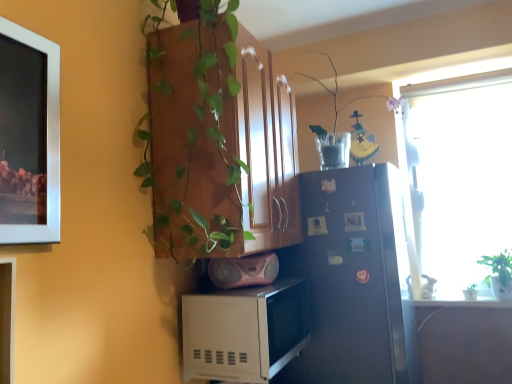
Question: Is satin black refrigerator at right further to the viewer compared to white matte microwave at lower center?

Choices:
 (A) no
 (B) yes

Answer: (B)

Question: From a real-world perspective, is satin black refrigerator at right under white matte microwave at lower center?

Choices:
 (A) yes
 (B) no

Answer: (B)

Question: Does satin black refrigerator at right contain white matte microwave at lower center?

Choices:
 (A) no
 (B) yes

Answer: (A)

Question: Does satin black refrigerator at right have a lesser width compared to white matte microwave at lower center?

Choices:
 (A) yes
 (B) no

Answer: (B)

Question: Is satin black refrigerator at right next to white matte microwave at lower center and touching it?

Choices:
 (A) yes
 (B) no

Answer: (B)

Question: Is point (493, 263) closer or farther from the camera than point (386, 100)?

Choices:
 (A) farther
 (B) closer

Answer: (B)

Question: Would you say green leafy plant at right is inside or outside clear glass vase at upper right?

Choices:
 (A) inside
 (B) outside

Answer: (B)

Question: Based on their positions, is green leafy plant at right located to the left or right of clear glass vase at upper right?

Choices:
 (A) right
 (B) left

Answer: (A)

Question: Looking at their shapes, would you say green leafy plant at right is wider or thinner than clear glass vase at upper right?

Choices:
 (A) wide
 (B) thin

Answer: (B)

Question: From the image's perspective, relative to pink matte speaker at center, is wooden cabinet at upper center above or below?

Choices:
 (A) below
 (B) above

Answer: (B)

Question: From their relative heights in the image, would you say wooden cabinet at upper center is taller or shorter than pink matte speaker at center?

Choices:
 (A) short
 (B) tall

Answer: (B)

Question: Is wooden cabinet at upper center situated inside pink matte speaker at center or outside?

Choices:
 (A) inside
 (B) outside

Answer: (B)

Question: Considering the positions of wooden cabinet at upper center and pink matte speaker at center in the image, is wooden cabinet at upper center bigger or smaller than pink matte speaker at center?

Choices:
 (A) small
 (B) big

Answer: (B)

Question: Relative to wooden cabinet at upper center, is clear glass vase at upper right in front or behind?

Choices:
 (A) front
 (B) behind

Answer: (B)

Question: Looking at the image, does clear glass vase at upper right seem bigger or smaller compared to wooden cabinet at upper center?

Choices:
 (A) big
 (B) small

Answer: (B)